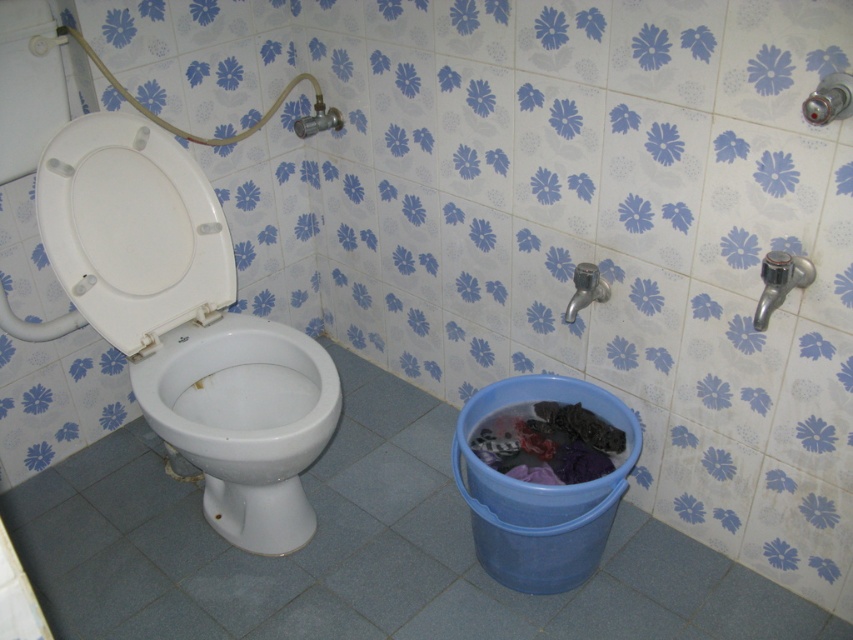
You are a bathroom cleaner who needs to place a new cleaning spray bottle between the white plastic toilet seat at left and the white glossy toilet bowl at left. Given that the spray bottle requires 0.5 square feet of space, can you fit it there?

The white plastic toilet seat at left occupies less space than the white glossy toilet bowl at left, so there is enough space between them to fit a spray bottle requiring 0.5 square feet.

You are a cleaning robot in a retro bathroom. You need to determine which object is taller between the white glossy toilet bowl at left and the dark fabric laundry at lower right. Which one is taller?

The white glossy toilet bowl at left is taller than the dark fabric laundry at lower right according to the description provided.